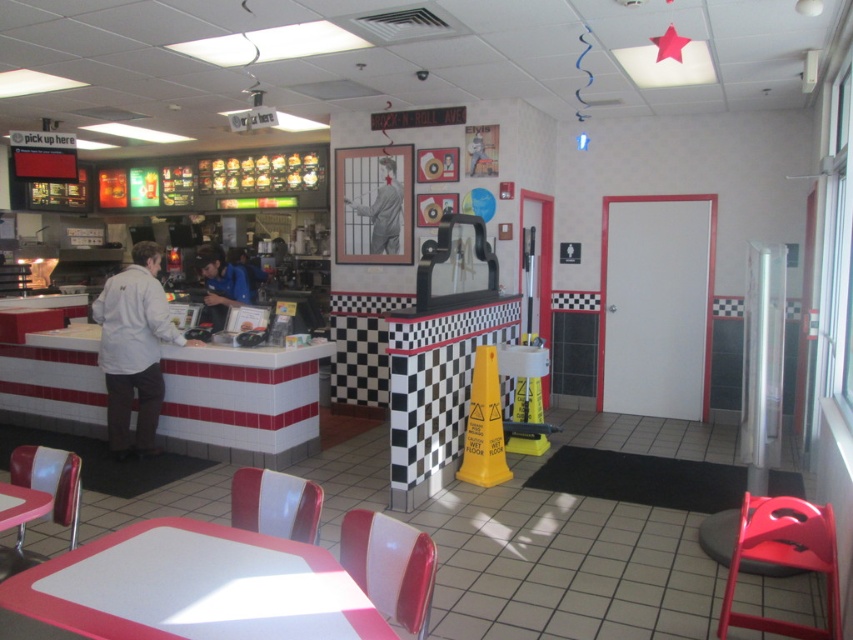
Does white glossy table at lower center come in front of matte white table at lower left?

Yes, white glossy table at lower center is closer to the viewer.

Locate an element on the screen. This screenshot has width=853, height=640. white glossy table at lower center is located at coordinates (195, 588).

Describe the element at coordinates (242, 403) in the screenshot. The width and height of the screenshot is (853, 640). I see `white glossy table at center` at that location.

Can you confirm if white glossy table at center is wider than gray matte mannequin at center?

Yes, white glossy table at center is wider than gray matte mannequin at center.

Locate an element on the screen. The height and width of the screenshot is (640, 853). white glossy table at center is located at coordinates (242, 403).

You are a GUI agent. You are given a task and a screenshot of the screen. Output one action in this format:
    pyautogui.click(x=<x>, y=<y>)
    Task: Click on the white glossy table at center
    This screenshot has width=853, height=640.
    Given the screenshot: What is the action you would take?
    pyautogui.click(x=242, y=403)

Between matte plastic chair at lower left and matte white table at lower left, which one has less height?

Standing shorter between the two is matte white table at lower left.

Which is above, matte plastic chair at lower left or matte white table at lower left?

Positioned higher is matte white table at lower left.

Describe the element at coordinates (50, 481) in the screenshot. The image size is (853, 640). I see `matte plastic chair at lower left` at that location.

Where is `matte plastic chair at lower left`? matte plastic chair at lower left is located at coordinates (50, 481).